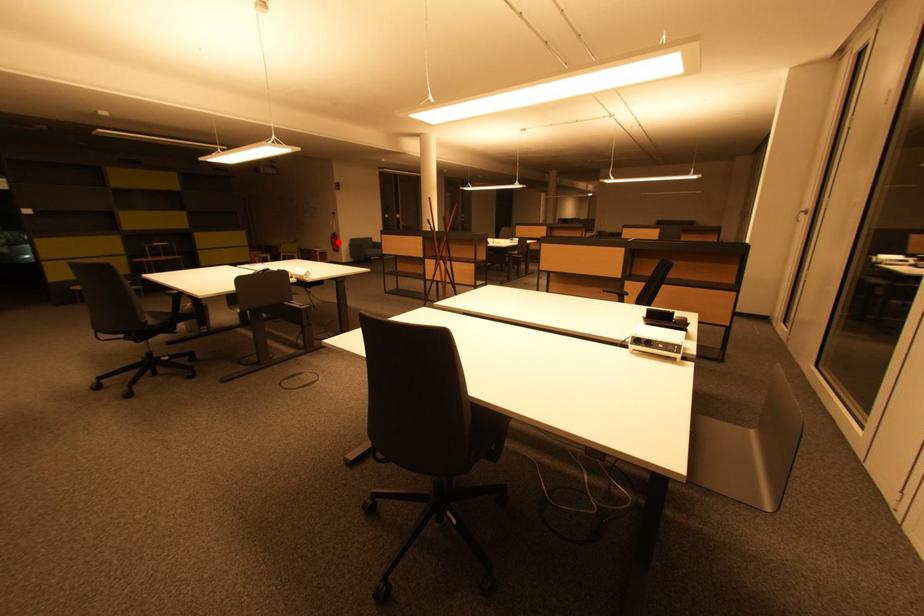
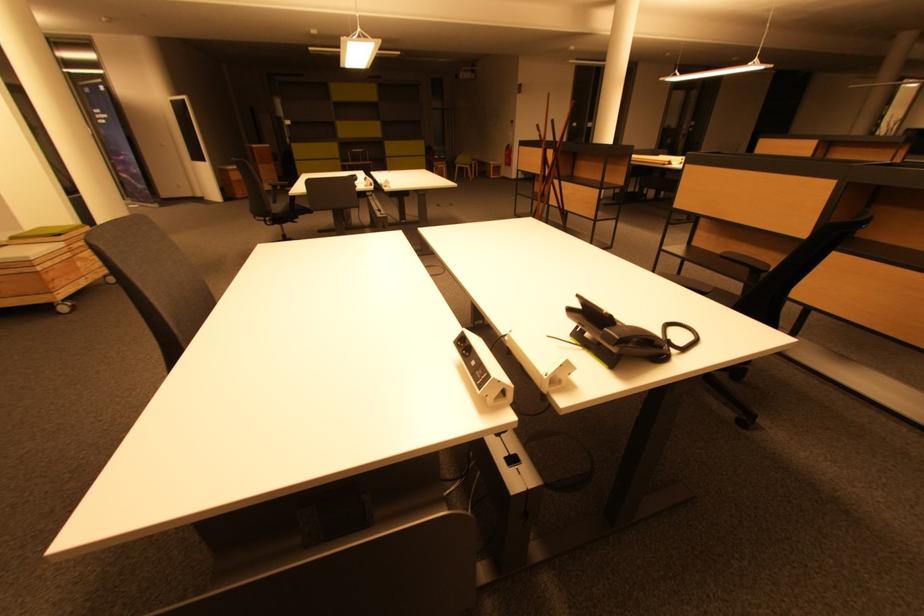
Question: A red point is marked in image1. In image2, is the corresponding 3D point closer to the camera or farther? Reply with the corresponding letter.

Choices:
 (A) The corresponding 3D point is closer.
 (B) The corresponding 3D point is farther.

Answer: (A)